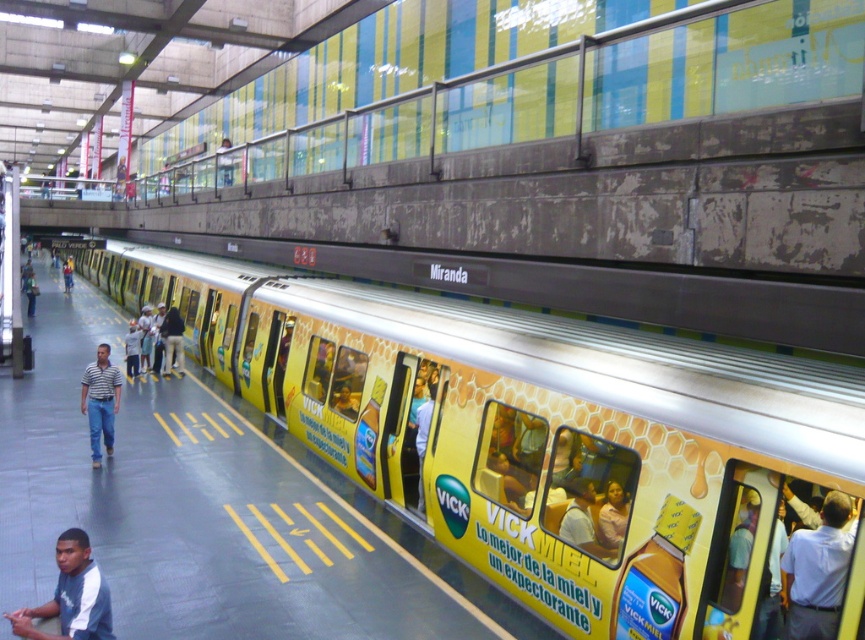
Question: Is blue jersey at lower left further to the viewer compared to striped cotton shirt at center?

Choices:
 (A) no
 (B) yes

Answer: (A)

Question: Which of the following is the farthest from the observer?

Choices:
 (A) blue jersey at lower left
 (B) yellow glossy train at center
 (C) light blue jeans at center

Answer: (C)

Question: Can you confirm if white shirt at center is bigger than striped cotton shirt at center?

Choices:
 (A) yes
 (B) no

Answer: (B)

Question: Can you confirm if yellow glossy train at center is positioned to the right of striped cotton shirt at center?

Choices:
 (A) no
 (B) yes

Answer: (B)

Question: Considering the real-world distances, which object is closest to the striped cotton shirt at center?

Choices:
 (A) light blue jeans at center
 (B) white shirt at center
 (C) blue jersey at lower left

Answer: (C)

Question: Based on their relative distances, which object is nearer to the matte black shirt at center?

Choices:
 (A) yellow glossy train at center
 (B) striped cotton shirt at center
 (C) blue jersey at lower left

Answer: (A)